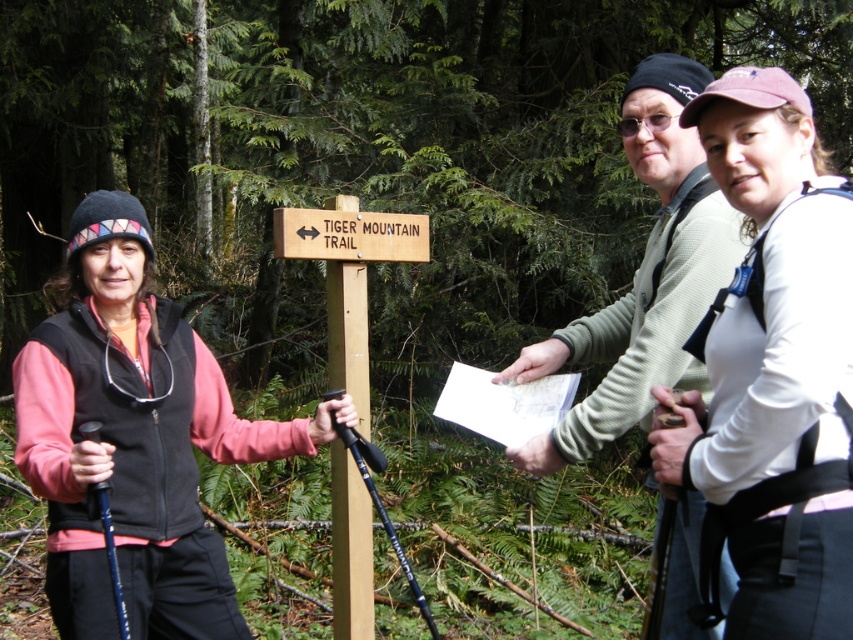
Which of these two, white matte shirt at upper right or light gray sweater at center, stands taller?

With more height is light gray sweater at center.

Can you confirm if white matte shirt at upper right is smaller than light gray sweater at center?

Yes.

Is point (801, 182) behind point (703, 240)?

No, (801, 182) is in front of (703, 240).

Find the location of `white matte shirt at upper right`. white matte shirt at upper right is located at coordinates (773, 371).

Identify the location of brushed metal hiking poles at left. The width and height of the screenshot is (853, 640). (134, 438).

How far apart are brushed metal hiking poles at left and light gray sweater at center?

brushed metal hiking poles at left is 3.44 feet from light gray sweater at center.

Which is behind, point (209, 634) or point (648, 392)?

Positioned behind is point (209, 634).

What are the coordinates of `brushed metal hiking poles at left` in the screenshot? It's located at (134, 438).

Is point (692, 481) in front of point (94, 612)?

Yes, point (692, 481) is in front of point (94, 612).

Which is behind, point (764, 564) or point (62, 388)?

Positioned behind is point (62, 388).

The width and height of the screenshot is (853, 640). Identify the location of white matte shirt at upper right. (773, 371).